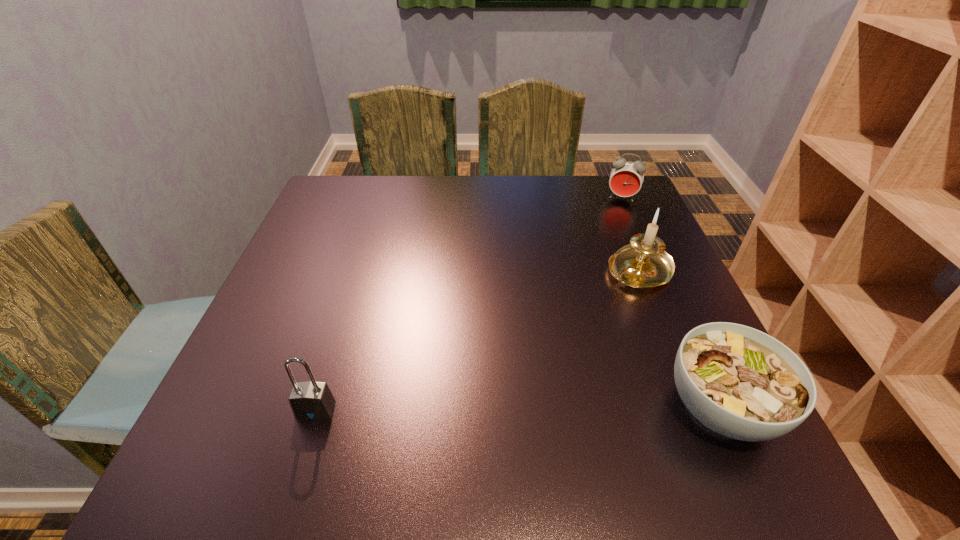
The width and height of the screenshot is (960, 540). In order to click on object located at the far right corner in this screenshot , I will do `click(626, 178)`.

At what (x,y) coordinates should I click in order to perform the action: click on object that is at the near right corner. Please return your answer as a coordinate pair (x, y). Image resolution: width=960 pixels, height=540 pixels. Looking at the image, I should click on (740, 382).

At what (x,y) coordinates should I click in order to perform the action: click on blank area at the far edge. Please return your answer as a coordinate pair (x, y). Image resolution: width=960 pixels, height=540 pixels. Looking at the image, I should click on (468, 191).

Where is `vacant space at the near edge of the desktop`? vacant space at the near edge of the desktop is located at coordinates (x=365, y=391).

I want to click on vacant space at the left edge of the desktop, so click(302, 239).

Locate an element on the screen. This screenshot has height=540, width=960. free location at the right edge is located at coordinates (675, 354).

You are a GUI agent. You are given a task and a screenshot of the screen. Output one action in this format:
    pyautogui.click(x=<x>, y=<y>)
    Task: Click on the vacant space at the far left corner of the desktop
    Image resolution: width=960 pixels, height=540 pixels.
    Given the screenshot: What is the action you would take?
    pyautogui.click(x=356, y=217)

The width and height of the screenshot is (960, 540). In the image, there is a desktop. What are the coordinates of `vacant space at the near left corner` in the screenshot? It's located at (x=266, y=402).

The image size is (960, 540). Find the location of `free spot at the far right corner of the desktop`. free spot at the far right corner of the desktop is located at coordinates tap(605, 179).

Where is `free space between the soup bowl and the tallest object`? free space between the soup bowl and the tallest object is located at coordinates (680, 339).